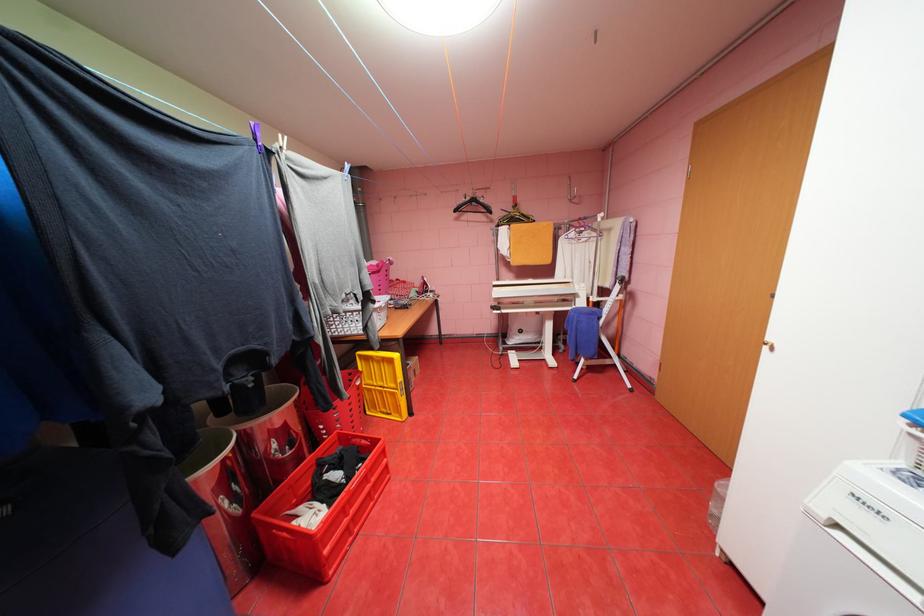
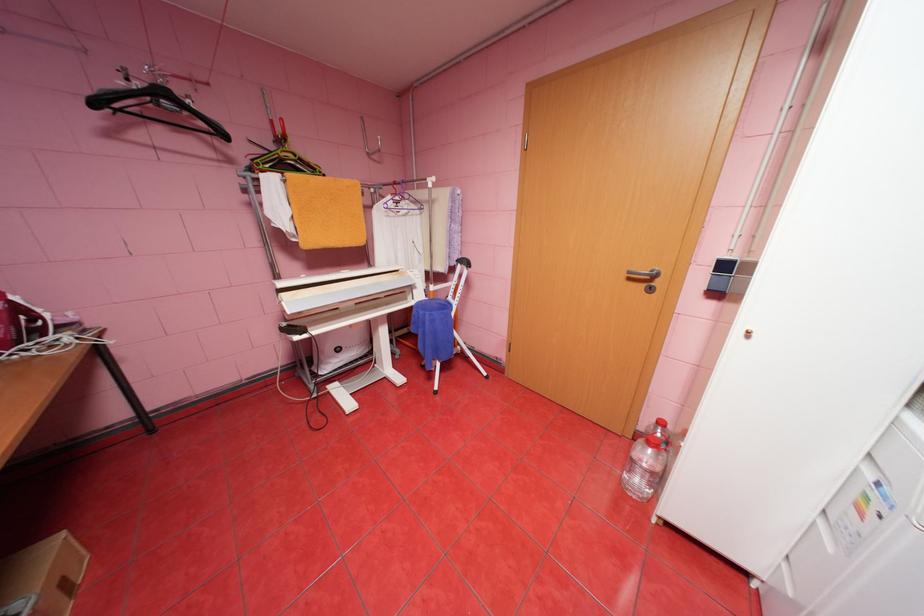
In the second image, find the point that corresponds to (x=464, y=209) in the first image.

(103, 103)